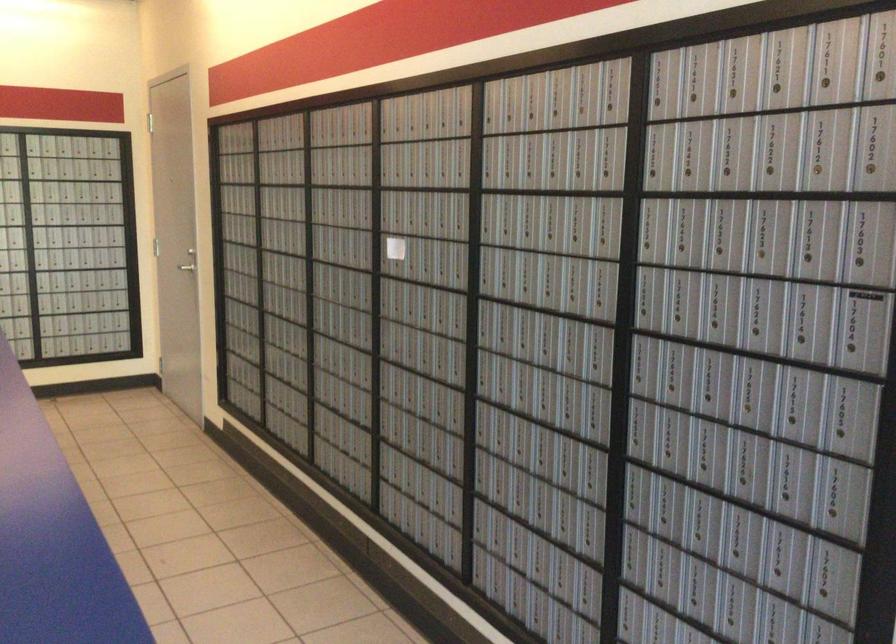
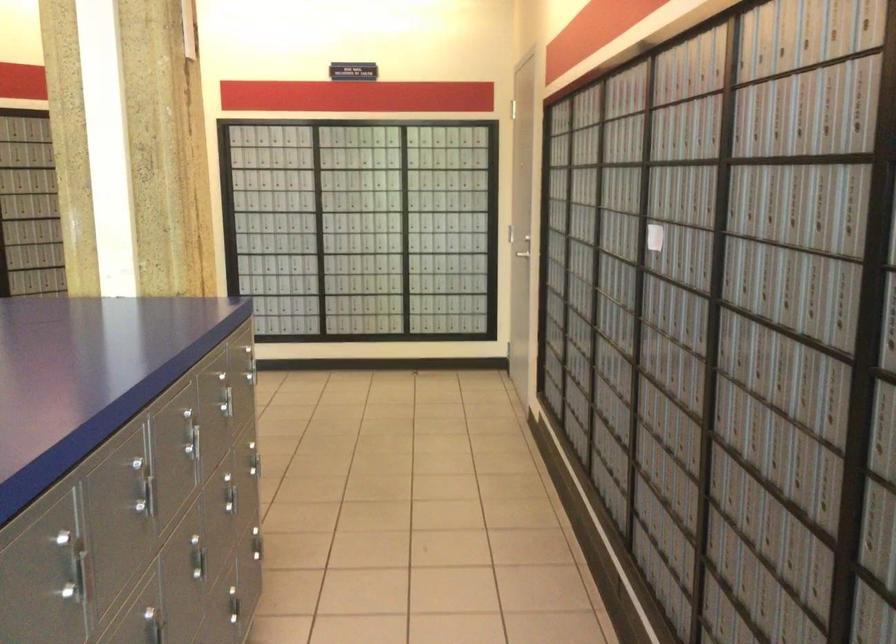
Question: The camera is either moving clockwise (left) or counter-clockwise (right) around the object. The first image is from the beginning of the video and the second image is from the end. Is the camera moving left or right when shooting the video?

Choices:
 (A) Left
 (B) Right

Answer: (B)